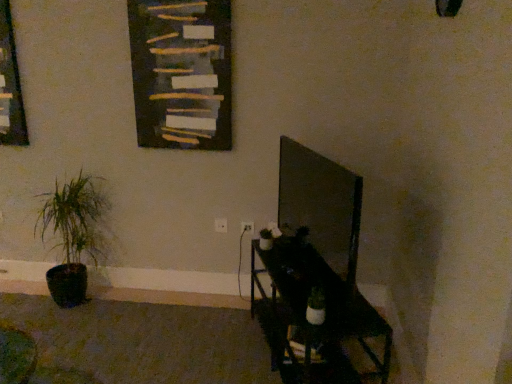
Question: Is dark wood bulletin board at upper center not close to green matte plant at left?

Choices:
 (A) no
 (B) yes

Answer: (A)

Question: Does dark wood bulletin board at upper center come in front of green matte plant at left?

Choices:
 (A) yes
 (B) no

Answer: (A)

Question: From the image's perspective, does dark wood bulletin board at upper center appear higher than green matte plant at left?

Choices:
 (A) no
 (B) yes

Answer: (B)

Question: Can you confirm if dark wood bulletin board at upper center is taller than green matte plant at left?

Choices:
 (A) yes
 (B) no

Answer: (B)

Question: Is the surface of dark wood bulletin board at upper center in direct contact with green matte plant at left?

Choices:
 (A) no
 (B) yes

Answer: (A)

Question: In the image, is green matte plant at left on the left side or the right side of wooden frame at left?

Choices:
 (A) right
 (B) left

Answer: (A)

Question: Considering the positions of green matte plant at left and wooden frame at left in the image, is green matte plant at left bigger or smaller than wooden frame at left?

Choices:
 (A) big
 (B) small

Answer: (A)

Question: Is point (90, 231) positioned closer to the camera than point (6, 79)?

Choices:
 (A) closer
 (B) farther

Answer: (B)

Question: From a real-world perspective, relative to wooden frame at left, is green matte plant at left vertically above or below?

Choices:
 (A) above
 (B) below

Answer: (B)

Question: Considering the positions of wooden frame at left and green matte plant at left in the image, is wooden frame at left taller or shorter than green matte plant at left?

Choices:
 (A) tall
 (B) short

Answer: (B)

Question: From a real-world perspective, relative to green matte plant at left, is wooden frame at left vertically above or below?

Choices:
 (A) below
 (B) above

Answer: (B)

Question: Does point (24, 120) appear closer or farther from the camera than point (72, 244)?

Choices:
 (A) closer
 (B) farther

Answer: (A)

Question: From the image's perspective, is wooden frame at left above or below green matte plant at left?

Choices:
 (A) above
 (B) below

Answer: (A)

Question: Is green matte plant at left to the left or to the right of dark wood bulletin board at upper center in the image?

Choices:
 (A) right
 (B) left

Answer: (B)

Question: From a real-world perspective, is green matte plant at left physically located above or below dark wood bulletin board at upper center?

Choices:
 (A) above
 (B) below

Answer: (B)